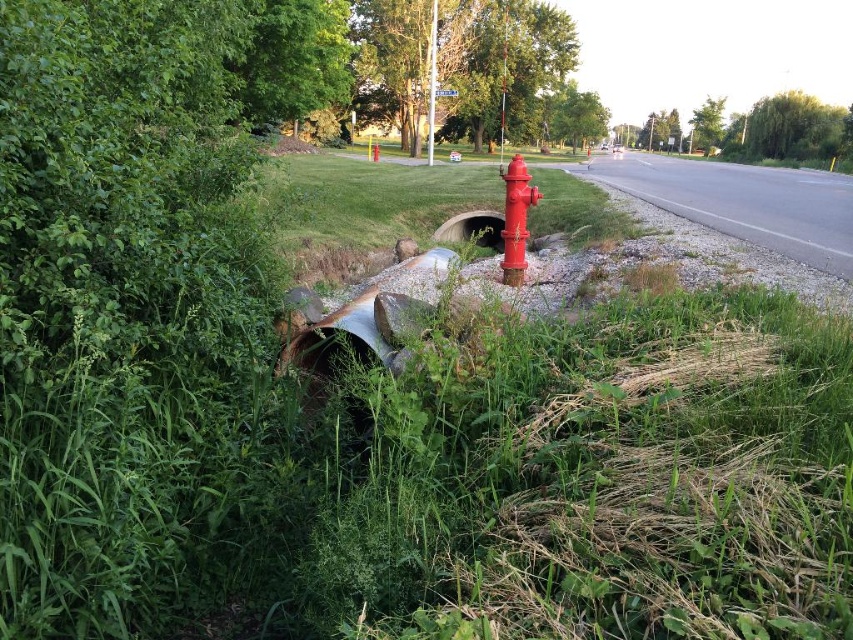
You are standing at the viewpoint of the camera and want to walk to one of the two points marked in the image. Which point, point [525,186] or point [492,216], would you reach first if you walk straight towards them?

You would reach point [525,186] first because it is closer to the camera than point [492,216].

You are a delivery driver who needs to park your truck near the shiny red fire hydrant at center and the rusty metal pipe at center. Since parking regulations prohibit parking within 5 meters of a fire hydrant, can you park your truck here?

The shiny red fire hydrant at center is in front of the rusty metal pipe at center, so the distance between them is less than 5 meters. Therefore, you cannot park your truck here due to the parking regulations prohibiting parking within 5 meters of a fire hydrant.